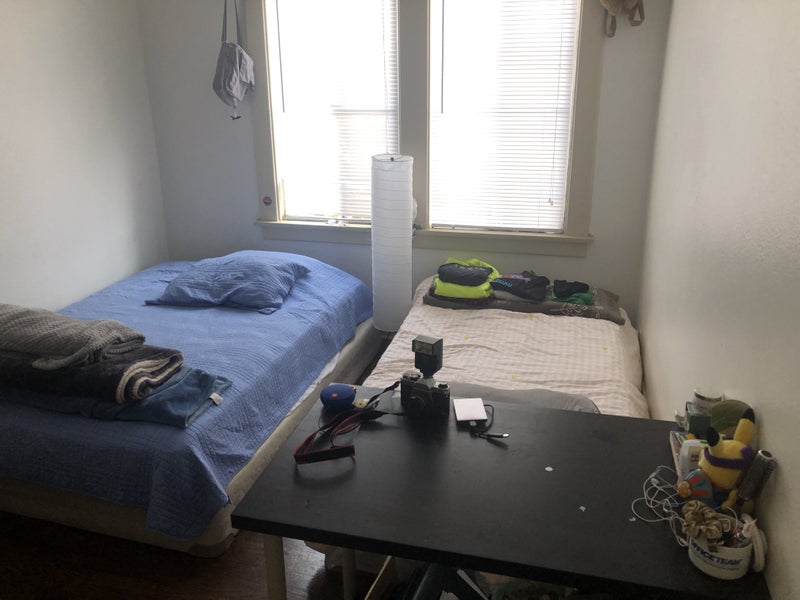
In order to click on white cord in this screenshot , I will do `click(657, 505)`.